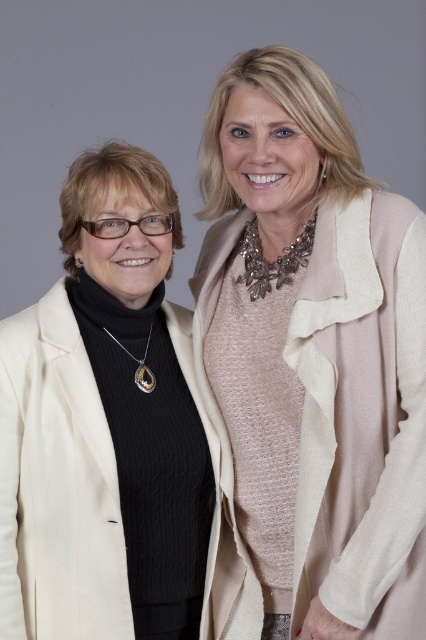
You are standing in front of the two women in the image. There are two points marked on the image. The first point is at coordinates point [207,426] and the second point is at point [405,509]. If you were to draw a straight line from your position to each point, which point would require the line to pass closer to the woman on the right?

Point [207,426] is behind point [405,509], so the line to point [405,509] would be closer to the woman on the right.

You are an artist trying to sketch the scene. You need to place the matte black turtleneck sweater at left exactly at point (x=104, y=426). Can you confirm the coordinates where the matte black turtleneck sweater at left is located?

The matte black turtleneck sweater at left is located at point (x=104, y=426).

You are a photographer setting up for a photoshoot. You want to ensure that both the matte black turtleneck sweater at left and the beige textured coat at upper right are clearly visible in the frame. Based on their positions, which clothing item might partially obscure the other?

The beige textured coat at upper right is behind the matte black turtleneck sweater at left, so the matte black turtleneck sweater at left might partially obscure the beige textured coat at upper right.